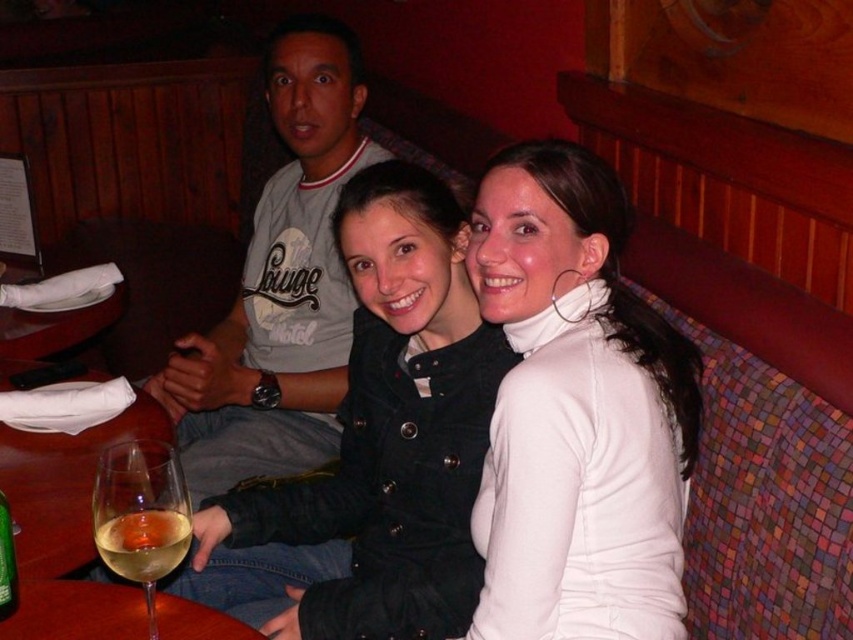
Question: Can you confirm if white matte turtleneck at center is positioned below clear glass wine at lower left?

Choices:
 (A) yes
 (B) no

Answer: (B)

Question: Which object is positioned closest to the clear glass wine at lower left?

Choices:
 (A) translucent glass at lower left
 (B) clear glass wine glass at lower left

Answer: (A)

Question: Is clear glass wine at lower left bigger than translucent glass wine at lower left?

Choices:
 (A) yes
 (B) no

Answer: (A)

Question: Which point is farther to the camera?

Choices:
 (A) (312, 400)
 (B) (78, 516)
 (C) (6, 525)

Answer: (A)

Question: Can you confirm if black velvet jacket at center is positioned to the left of translucent glass wine at lower left?

Choices:
 (A) no
 (B) yes

Answer: (A)

Question: Among these points, which one is nearest to the camera?

Choices:
 (A) (169, 572)
 (B) (39, 564)

Answer: (A)